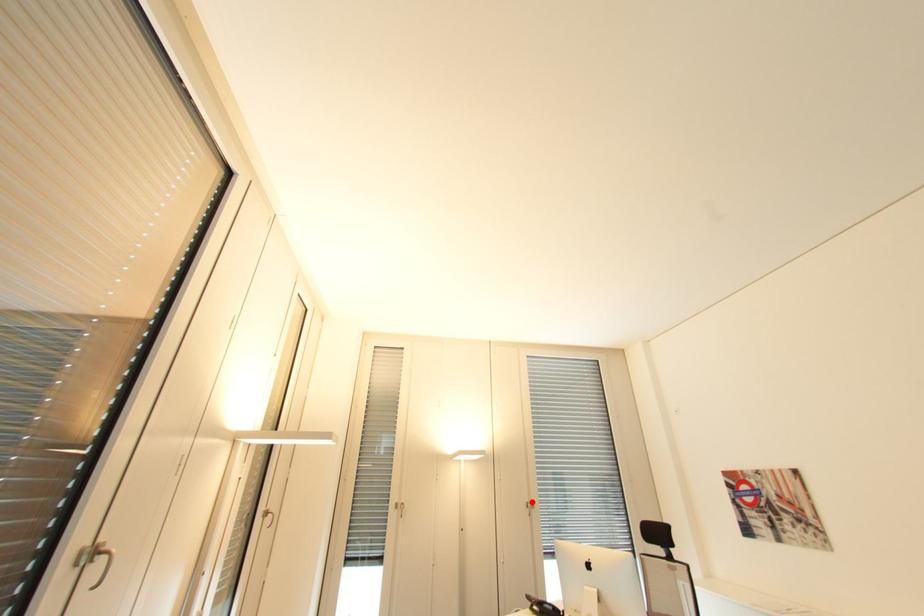
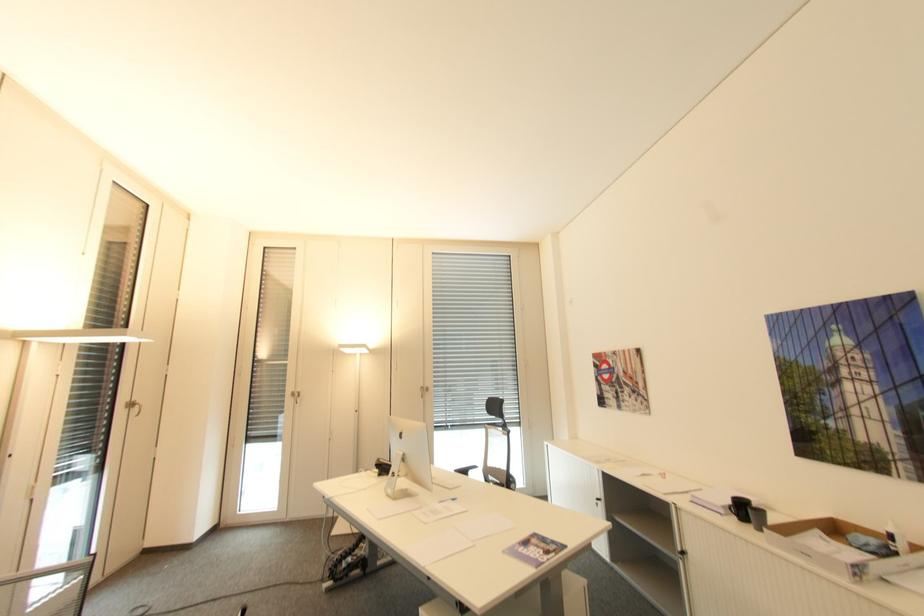
In the second image, find the point that corresponds to the highlighted location in the first image.

(427, 387)